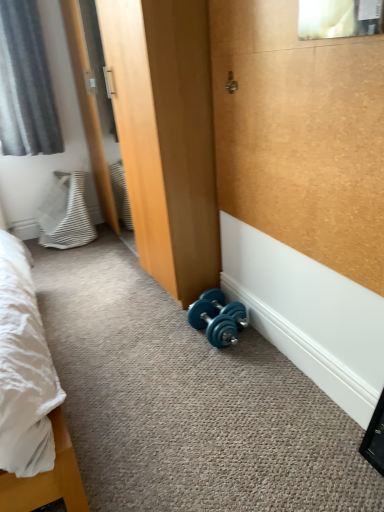
Question: Is white striped fabric pillow at left completely or partially outside of gray fabric curtain at upper left?

Choices:
 (A) yes
 (B) no

Answer: (A)

Question: Can you confirm if white striped fabric pillow at left is smaller than gray fabric curtain at upper left?

Choices:
 (A) no
 (B) yes

Answer: (B)

Question: Is white striped fabric pillow at left thinner than gray fabric curtain at upper left?

Choices:
 (A) yes
 (B) no

Answer: (B)

Question: Is gray fabric curtain at upper left at the back of white striped fabric pillow at left?

Choices:
 (A) yes
 (B) no

Answer: (B)

Question: Can you see white striped fabric pillow at left touching gray fabric curtain at upper left?

Choices:
 (A) no
 (B) yes

Answer: (A)

Question: Is white striped fabric pillow at left bigger than gray fabric curtain at upper left?

Choices:
 (A) yes
 (B) no

Answer: (B)

Question: Is gray fabric curtain at upper left positioned beyond the bounds of clear glass mirror at upper center?

Choices:
 (A) yes
 (B) no

Answer: (A)

Question: Does gray fabric curtain at upper left have a lesser width compared to clear glass mirror at upper center?

Choices:
 (A) no
 (B) yes

Answer: (A)

Question: Is gray fabric curtain at upper left wider than clear glass mirror at upper center?

Choices:
 (A) yes
 (B) no

Answer: (A)

Question: From the image's perspective, does gray fabric curtain at upper left appear lower than clear glass mirror at upper center?

Choices:
 (A) no
 (B) yes

Answer: (A)

Question: Can you confirm if gray fabric curtain at upper left is positioned to the left of clear glass mirror at upper center?

Choices:
 (A) no
 (B) yes

Answer: (B)

Question: From a real-world perspective, is gray fabric curtain at upper left located beneath clear glass mirror at upper center?

Choices:
 (A) no
 (B) yes

Answer: (B)

Question: Can you confirm if gray fabric curtain at upper left is wider than white striped fabric pillow at left?

Choices:
 (A) no
 (B) yes

Answer: (A)